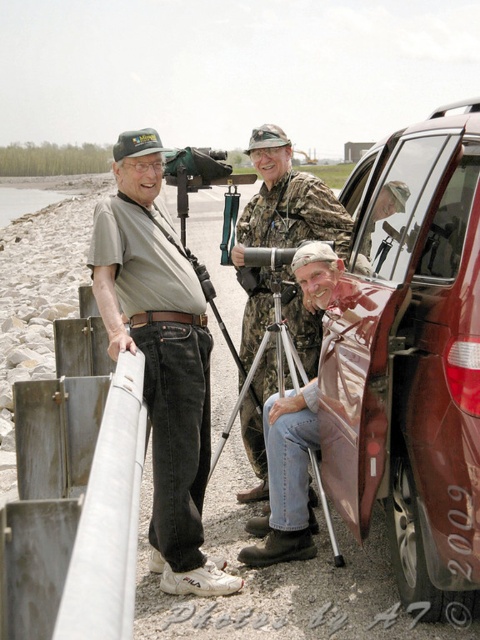
How distant is shiny metallic car door at right from matte gray shirt at left?

A distance of 38.49 inches exists between shiny metallic car door at right and matte gray shirt at left.

Between point (368, 192) and point (203, 557), which one is positioned in front?

Point (203, 557) is in front.

Image resolution: width=480 pixels, height=640 pixels. Identify the location of shiny metallic car door at right. tap(412, 362).

Does shiny metallic car door at right have a lesser height compared to camouflage fabric uniform at center?

In fact, shiny metallic car door at right may be taller than camouflage fabric uniform at center.

Which is in front, point (417, 392) or point (336, 205)?

Positioned in front is point (417, 392).

This screenshot has height=640, width=480. What do you see at coordinates (412, 362) in the screenshot?
I see `shiny metallic car door at right` at bounding box center [412, 362].

Image resolution: width=480 pixels, height=640 pixels. I want to click on shiny metallic car door at right, so click(x=412, y=362).

Looking at this image, is shiny metallic car door at right to the right of silver metallic tripod at center from the viewer's perspective?

Yes, shiny metallic car door at right is to the right of silver metallic tripod at center.

Can you confirm if shiny metallic car door at right is positioned below silver metallic tripod at center?

No.

The image size is (480, 640). I want to click on shiny metallic car door at right, so click(412, 362).